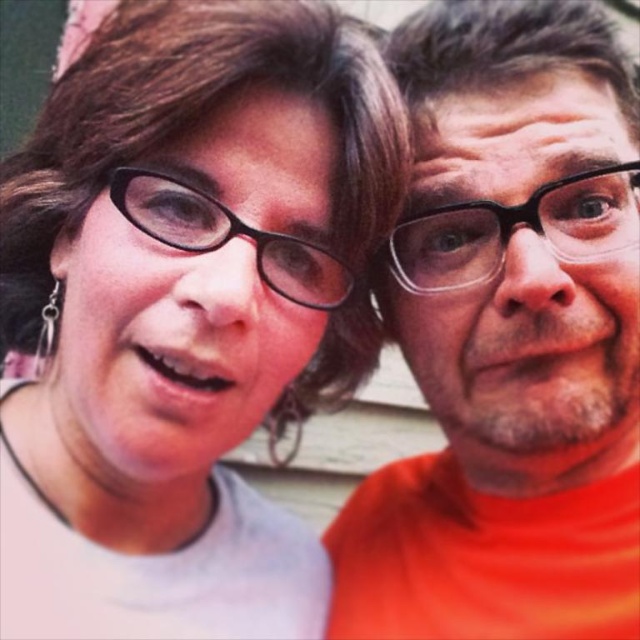
Measure the distance between matte black glasses at upper left and camera.

The distance of matte black glasses at upper left from camera is 17.06 inches.

Is point (200, 282) closer to camera compared to point (180, 188)?

Yes, point (200, 282) is in front of point (180, 188).

You are a GUI agent. You are given a task and a screenshot of the screen. Output one action in this format:
    pyautogui.click(x=<x>, y=<y>)
    Task: Click on the matte black glasses at upper left
    The image size is (640, 640).
    Given the screenshot: What is the action you would take?
    pyautogui.click(x=184, y=310)

I want to click on matte black glasses at upper left, so click(184, 310).

Is point (173, 60) closer to camera compared to point (513, 488)?

Yes.

I want to click on matte black glasses at upper left, so pos(184,310).

Who is higher up, orange matte shirt at center or black plastic glasses at center?

black plastic glasses at center

Which is more to the left, orange matte shirt at center or black plastic glasses at center?

From the viewer's perspective, black plastic glasses at center appears more on the left side.

Where is `orange matte shirt at center`? The height and width of the screenshot is (640, 640). orange matte shirt at center is located at coordinates (508, 337).